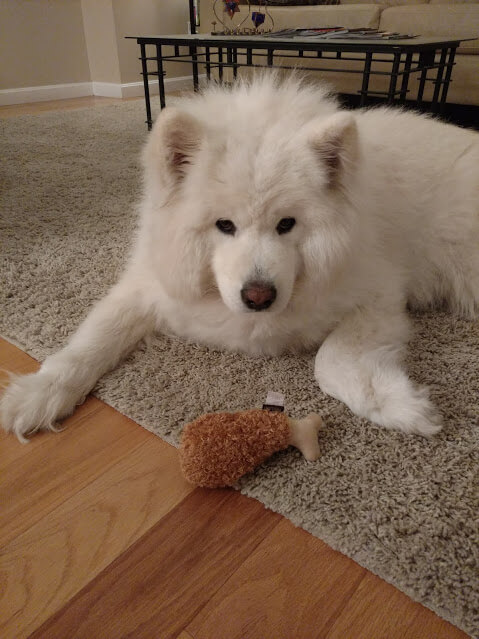
Where is `wood plank floor is varying shades`? Image resolution: width=479 pixels, height=639 pixels. wood plank floor is varying shades is located at coordinates (199, 594).